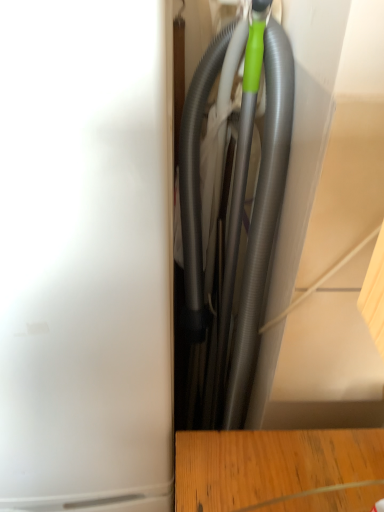
Question: Considering the relative positions of matte gray vacuum cleaner at center and gray rubber garden hose at center in the image provided, is matte gray vacuum cleaner at center to the left or to the right of gray rubber garden hose at center?

Choices:
 (A) left
 (B) right

Answer: (A)

Question: In terms of width, does matte gray vacuum cleaner at center look wider or thinner when compared to gray rubber garden hose at center?

Choices:
 (A) thin
 (B) wide

Answer: (B)

Question: Is matte gray vacuum cleaner at center inside the boundaries of gray rubber garden hose at center, or outside?

Choices:
 (A) outside
 (B) inside

Answer: (A)

Question: From a real-world perspective, is gray rubber garden hose at center positioned above or below matte gray vacuum cleaner at center?

Choices:
 (A) above
 (B) below

Answer: (A)

Question: In the image, is gray rubber garden hose at center on the left side or the right side of matte gray vacuum cleaner at center?

Choices:
 (A) right
 (B) left

Answer: (A)

Question: Considering the positions of gray rubber garden hose at center and matte gray vacuum cleaner at center in the image, is gray rubber garden hose at center bigger or smaller than matte gray vacuum cleaner at center?

Choices:
 (A) small
 (B) big

Answer: (A)

Question: From their relative heights in the image, would you say gray rubber garden hose at center is taller or shorter than matte gray vacuum cleaner at center?

Choices:
 (A) tall
 (B) short

Answer: (B)